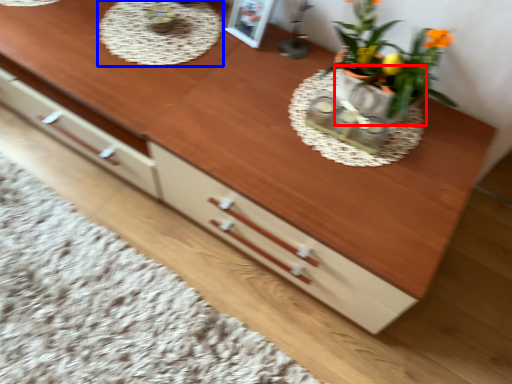
Question: Which point is further to the camera, flowerpot (highlighted by a red box) or round table (highlighted by a blue box)?

Choices:
 (A) flowerpot
 (B) round table

Answer: (B)